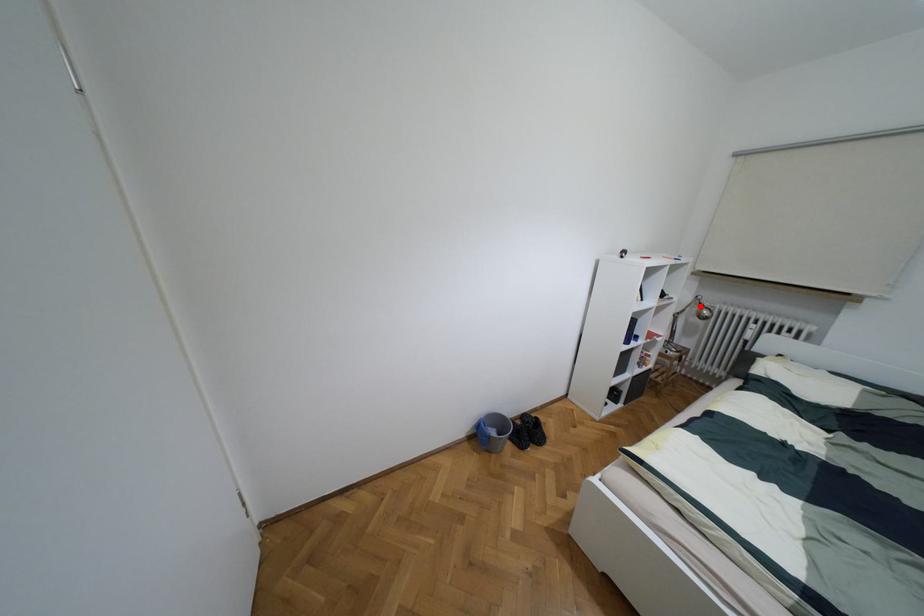
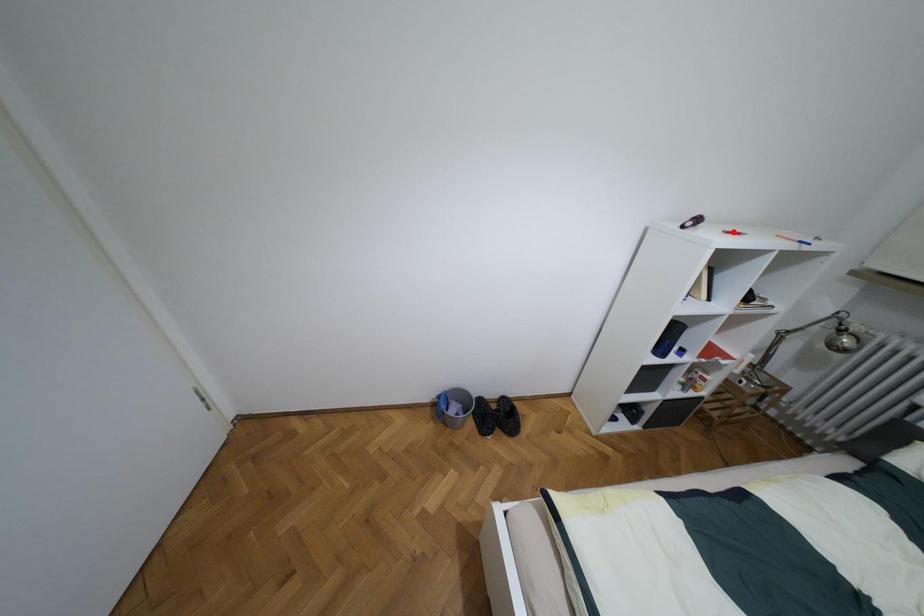
I am providing you with two images of the same scene from different viewpoints. A red point is marked on the first image and another point is marked on the second image. Do the highlighted points in image1 and image2 indicate the same real-world spot?

No